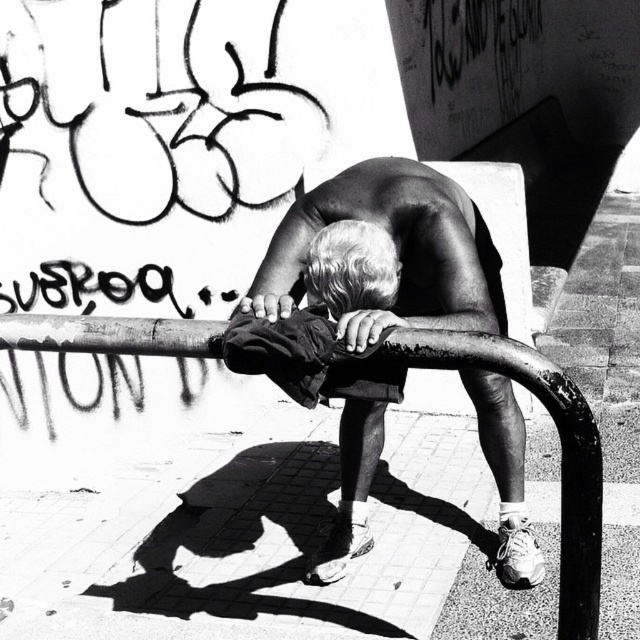
This screenshot has height=640, width=640. What do you see at coordinates (364, 308) in the screenshot? I see `smooth skin man at center` at bounding box center [364, 308].

Identify the location of smooth skin man at center. (x=364, y=308).

Who is more forward, [323,252] or [51,300]?

Positioned in front is point [323,252].

Does point (308, 324) lie behind point (12, 284)?

No, (308, 324) is in front of (12, 284).

This screenshot has width=640, height=640. What do you see at coordinates (332, 369) in the screenshot?
I see `dark fabric shorts at center` at bounding box center [332, 369].

I want to click on dark fabric shorts at center, so click(332, 369).

Who is shorter, dark fabric shorts at center or rusty metal rail at center?

dark fabric shorts at center

Does dark fabric shorts at center come in front of rusty metal rail at center?

No.

Who is more distant from viewer, (284, 330) or (205, 344)?

Positioned behind is point (205, 344).

Locate an element on the screen. This screenshot has height=640, width=640. dark fabric shorts at center is located at coordinates (332, 369).